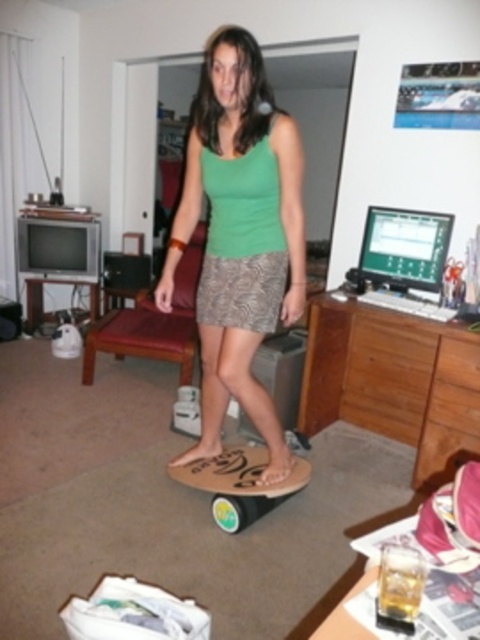
You are a photographer setting up a shot in the living room. You need to place two markers at the locations of point (207, 80) and point (218, 477). Which marker should you place first if you want to start with the one closer to the camera?

You should place the marker at point (207, 80) first because it is closer to the camera than point (218, 477).

You are a photographer setting up for a photoshoot in the living room described. You need to ensure that both the green fabric tank top at center and the wooden skateboard at center are clearly visible in the shot. Based on their positions, which object should you focus on first to ensure depth of field captures both?

The green fabric tank top at center is closer to the viewer than the wooden skateboard at center. To ensure both are in focus, you should focus on the green fabric tank top at center first since it is closer, allowing the depth of field to extend towards the wooden skateboard at center.